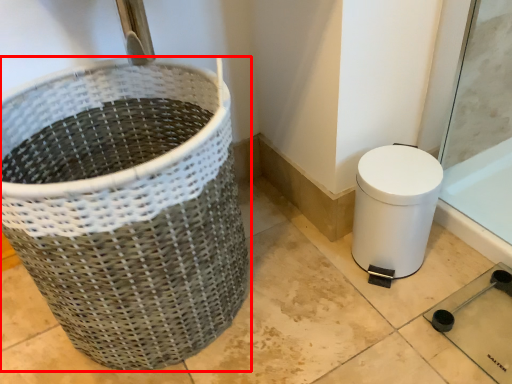
Question: From the image's perspective, where is waste container (annotated by the red box) located in relation to toilet bowl in the image?

Choices:
 (A) above
 (B) below

Answer: (A)